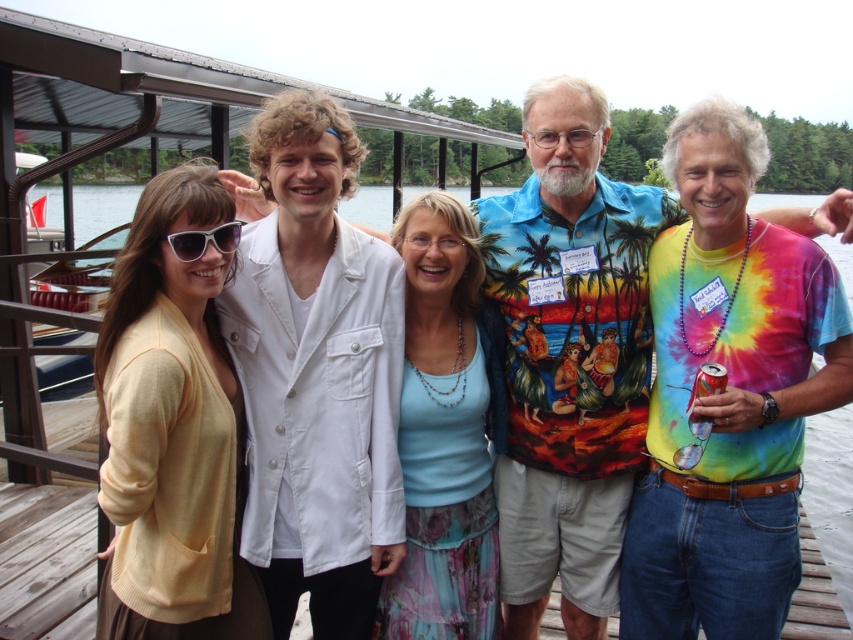
Question: Estimate the real-world distances between objects in this image. Which object is closer to the matte white sunglasses at left?

Choices:
 (A) blue fabric skirt at center
 (B) white matte blazer at center

Answer: (B)

Question: Does white matte blazer at center come in front of blue fabric skirt at center?

Choices:
 (A) yes
 (B) no

Answer: (A)

Question: Can you confirm if matte yellow cardigan at center is positioned to the right of blue fabric skirt at center?

Choices:
 (A) no
 (B) yes

Answer: (A)

Question: Is matte yellow cardigan at center bigger than blue fabric skirt at center?

Choices:
 (A) yes
 (B) no

Answer: (A)

Question: Which of these objects is positioned farthest from the matte white sunglasses at left?

Choices:
 (A) tie-dye fabric shirt at right
 (B) blue fabric skirt at center
 (C) white matte blazer at center

Answer: (A)

Question: Which point is closer to the camera?

Choices:
 (A) [x=132, y=340]
 (B) [x=200, y=243]

Answer: (A)